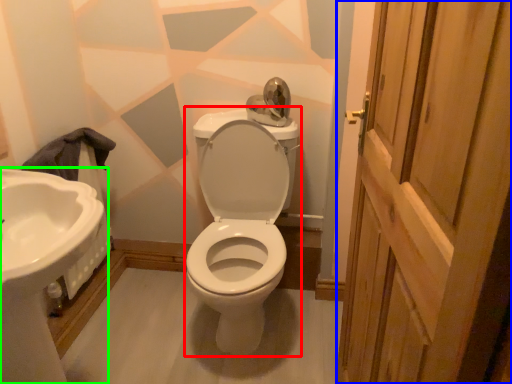
Question: Which object is positioned farthest from porcelain (highlighted by a red box)? Select from screen door (highlighted by a blue box) and sink (highlighted by a green box).

Choices:
 (A) screen door
 (B) sink

Answer: (A)